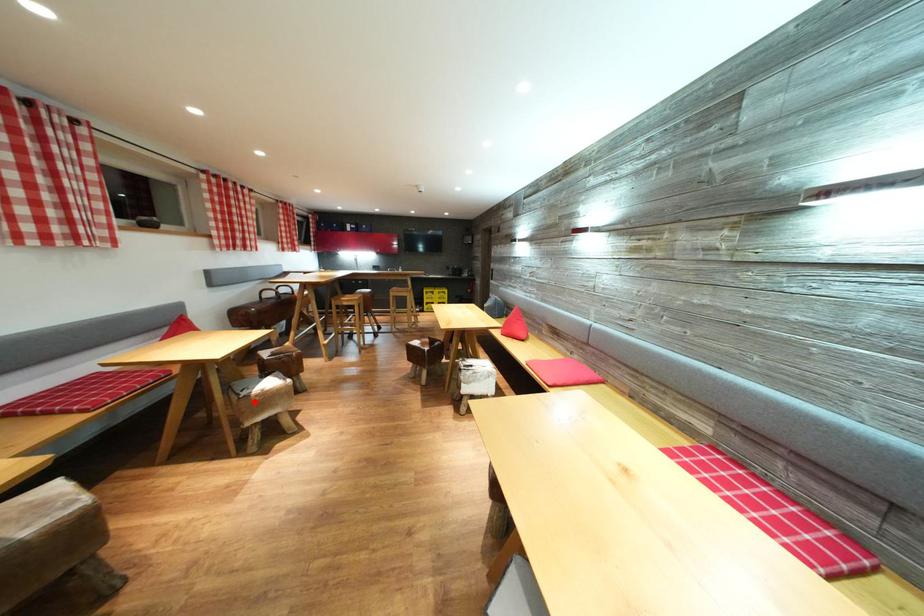
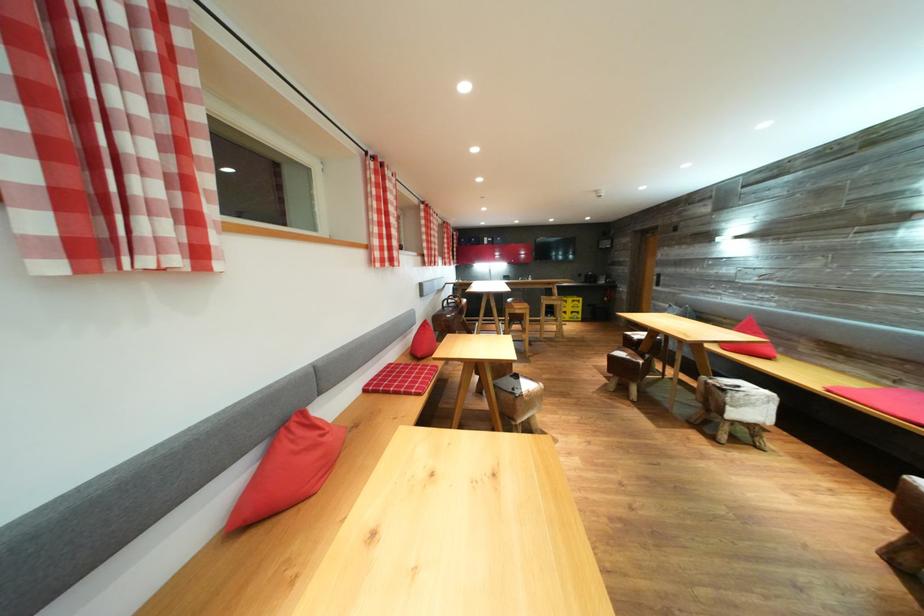
Locate, in the second image, the point that corresponds to the highlighted location in the first image.

(528, 400)